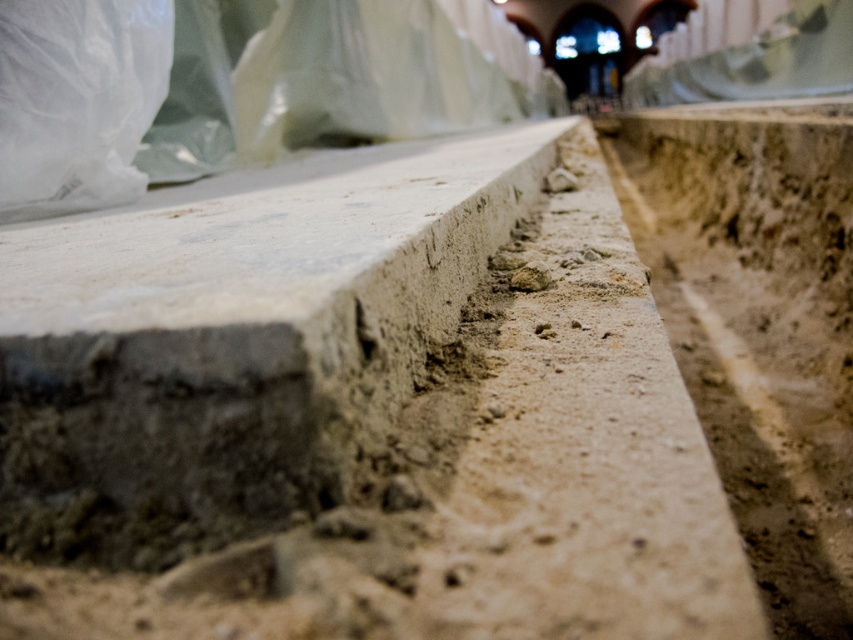
Question: Considering the relative positions of smooth concrete at center and transparent plastic bag at upper left in the image provided, where is smooth concrete at center located with respect to transparent plastic bag at upper left?

Choices:
 (A) below
 (B) above

Answer: (A)

Question: Can you confirm if smooth concrete at center is positioned above transparent plastic bag at upper left?

Choices:
 (A) yes
 (B) no

Answer: (B)

Question: Where is smooth concrete at center located in relation to transparent plastic bag at upper left in the image?

Choices:
 (A) below
 (B) above

Answer: (A)